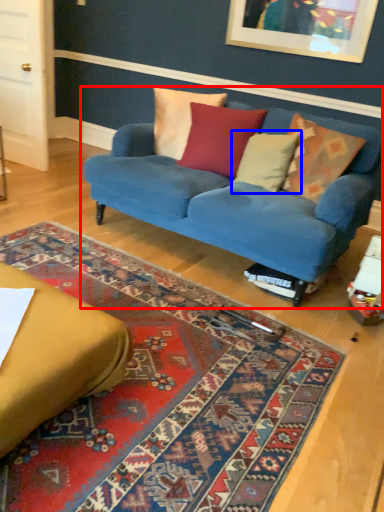
Question: Which of the following is the closest to the observer, studio couch (highlighted by a red box) or pillow (highlighted by a blue box)?

Choices:
 (A) studio couch
 (B) pillow

Answer: (A)